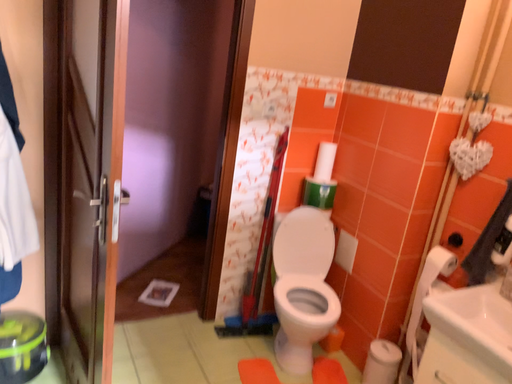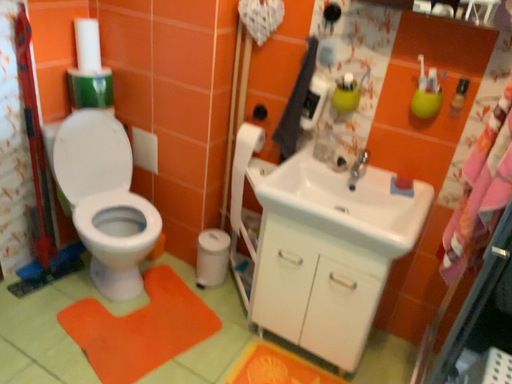
Question: How did the camera likely rotate when shooting the video?

Choices:
 (A) rotated left
 (B) rotated right

Answer: (B)